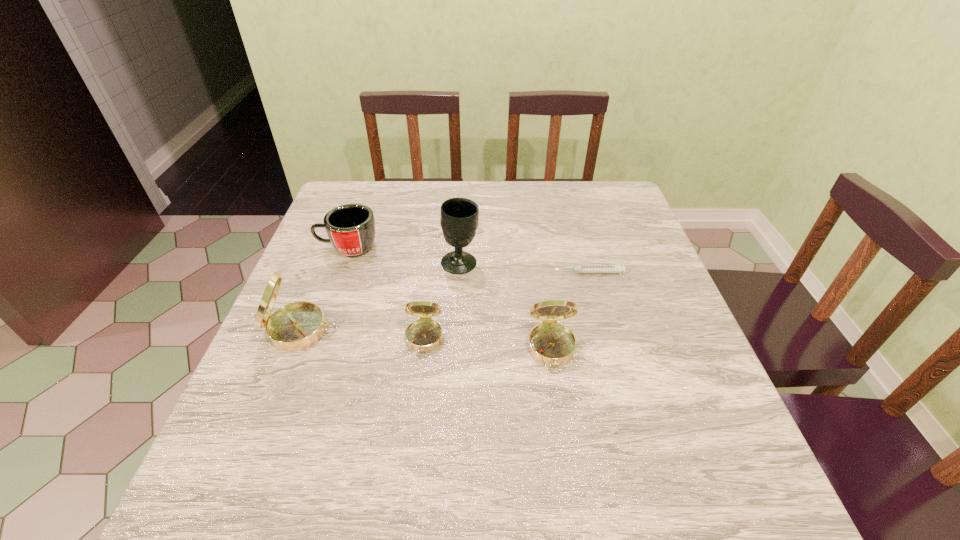
Considering the uniform spacing of compasss, where should an additional compass be positioned on the right? Please locate a free spot. Please provide its 2D coordinates. Your answer should be formatted as a tuple, i.e. [(x, y)], where the tuple contains the x and y coordinates of a point satisfying the conditions above.

[(684, 360)]